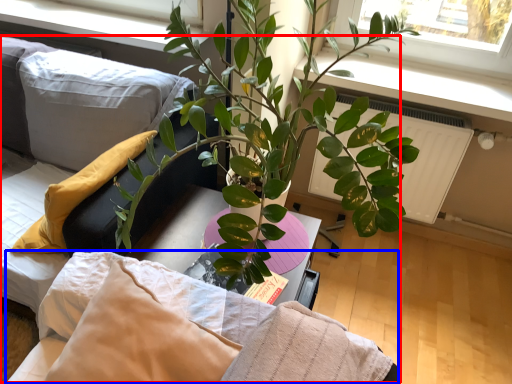
Question: Which object appears farthest to the camera in this image, bed (highlighted by a red box) or bedding (highlighted by a blue box)?

Choices:
 (A) bed
 (B) bedding

Answer: (B)